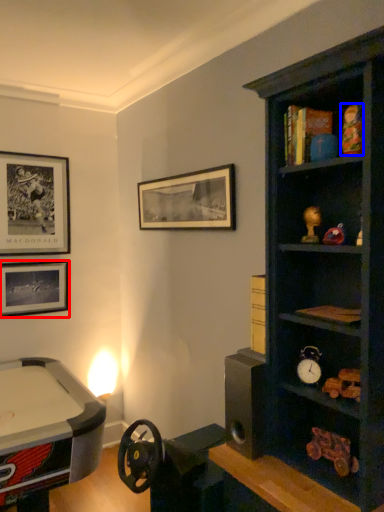
Question: Which of the following is the farthest to the observer, picture frame (highlighted by a red box) or toy (highlighted by a blue box)?

Choices:
 (A) picture frame
 (B) toy

Answer: (A)